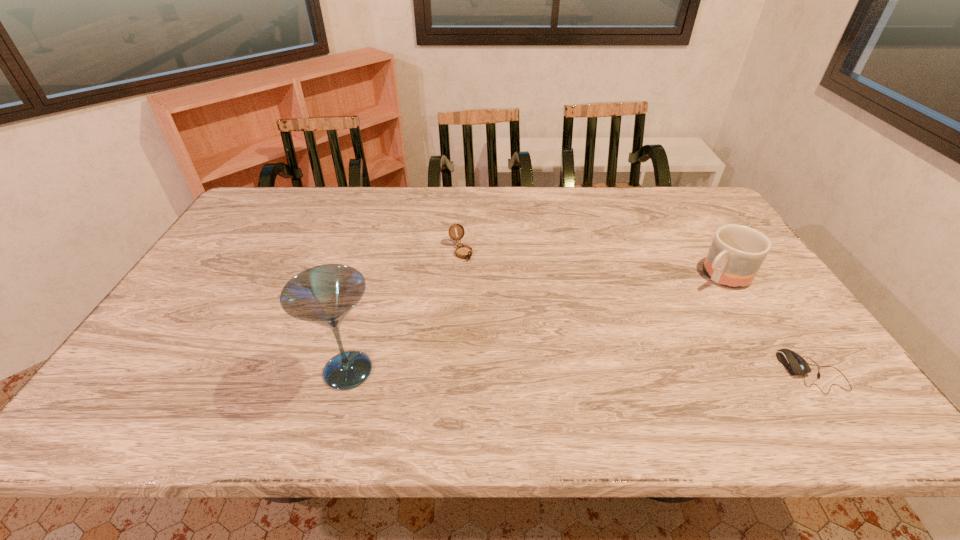
Find the location of a particular element. free space at the left edge of the desktop is located at coordinates (224, 299).

I want to click on free space at the right edge of the desktop, so click(x=751, y=308).

Where is `vacant area at the far left corner of the desktop`? The height and width of the screenshot is (540, 960). vacant area at the far left corner of the desktop is located at coordinates (283, 206).

The image size is (960, 540). What are the coordinates of `blank region between the computer mouse and the third object from right to left` in the screenshot? It's located at (636, 312).

Locate an element on the screen. The height and width of the screenshot is (540, 960). vacant region between the computer mouse and the mug is located at coordinates (767, 323).

The height and width of the screenshot is (540, 960). I want to click on free space between the leftmost object and the third tallest object, so click(x=404, y=311).

Find the location of a particular element. This screenshot has width=960, height=540. unoccupied area between the second tallest object and the computer mouse is located at coordinates (767, 323).

The width and height of the screenshot is (960, 540). In order to click on unoccupied area between the martini and the computer mouse in this screenshot , I will do `click(581, 372)`.

Locate an element on the screen. vacant area between the shortest object and the second shortest object is located at coordinates (636, 312).

What are the coordinates of `free area in between the tallest object and the computer mouse` in the screenshot? It's located at (581, 372).